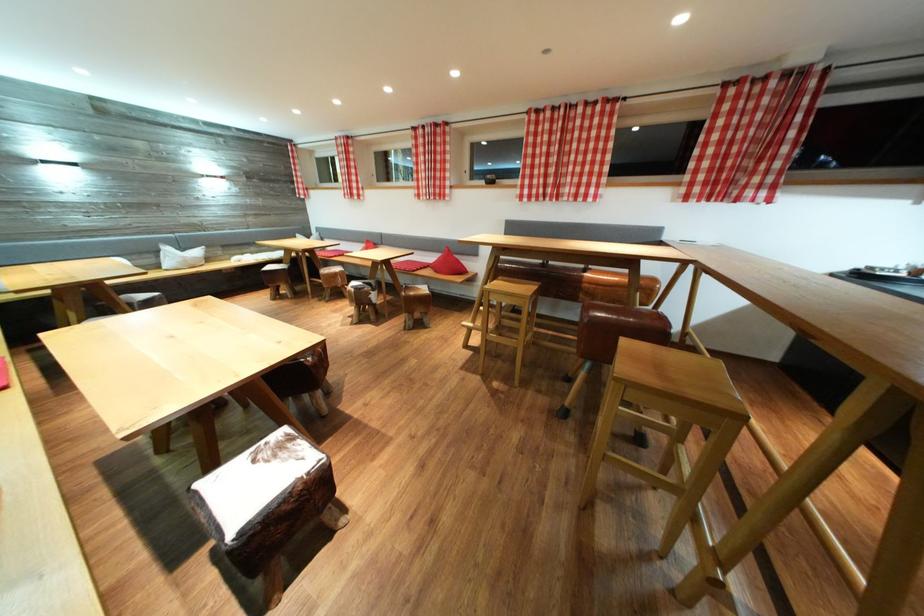
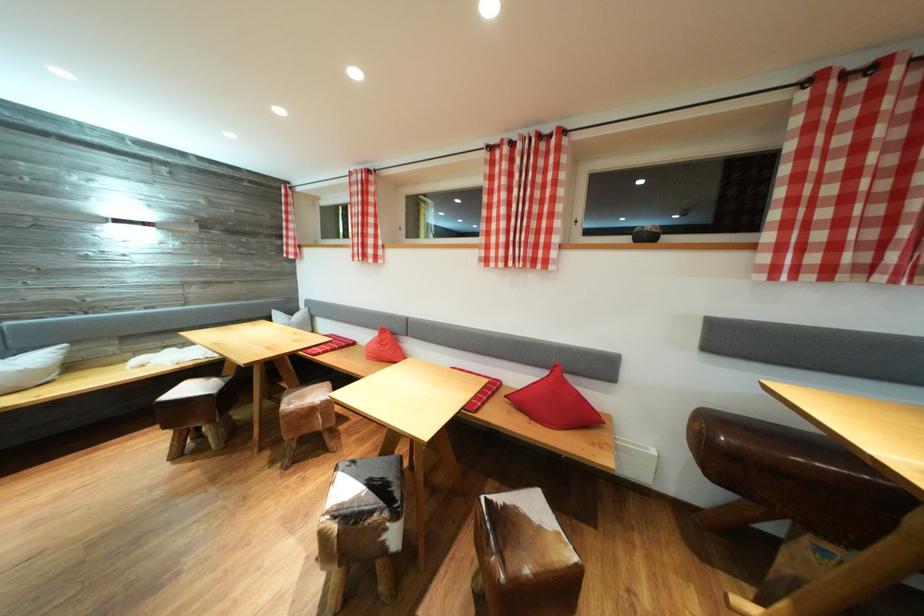
The point at (188,254) is marked in the first image. Where is the corresponding point in the second image?

(14, 358)